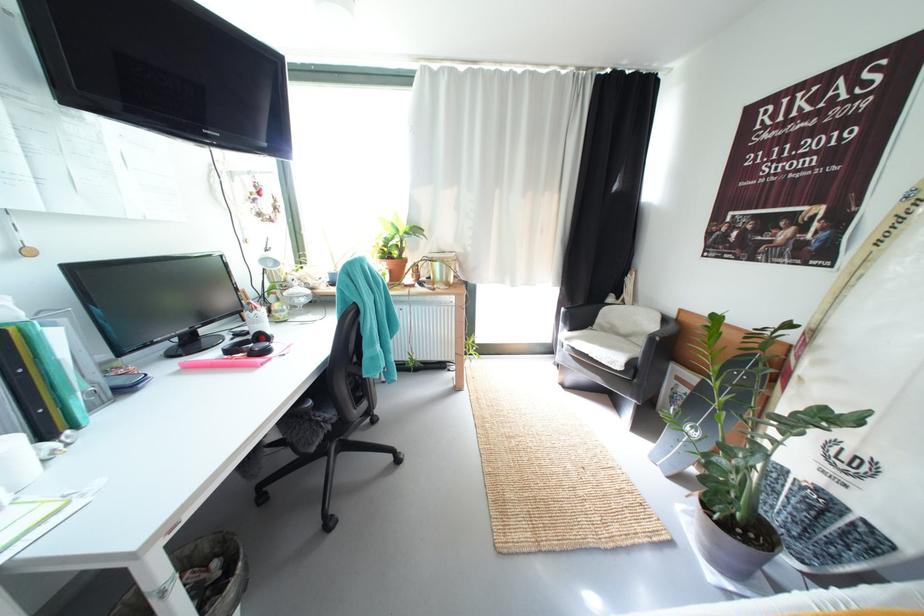
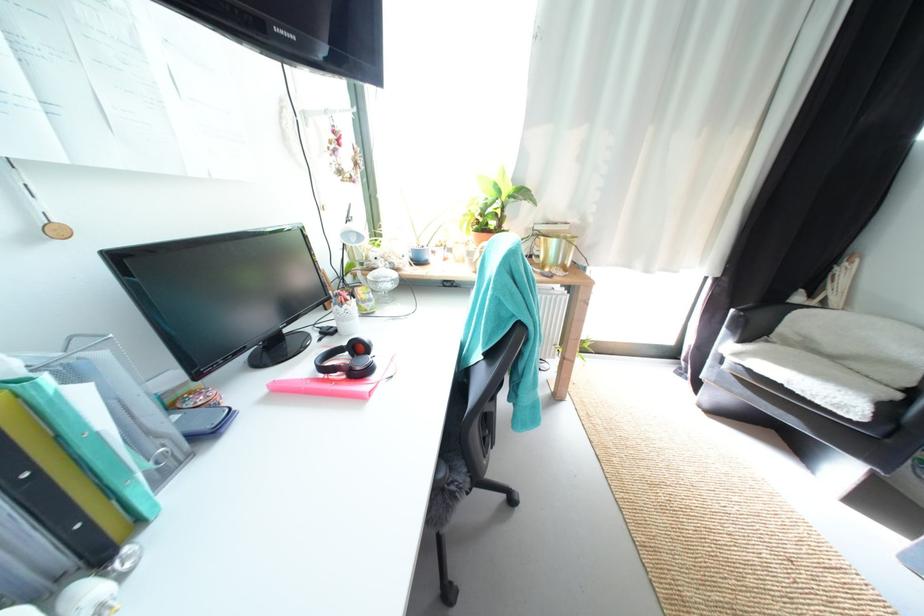
Locate, in the second image, the point that corresponds to (290,313) in the first image.

(378, 302)